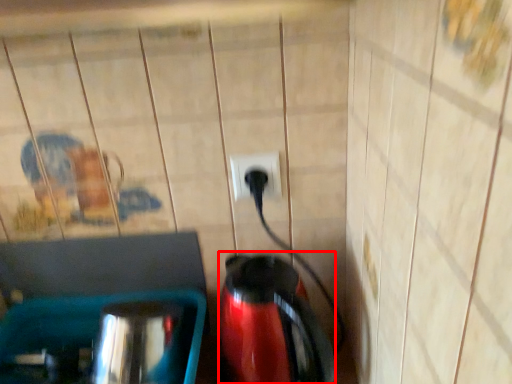
Question: From the image's perspective, what is the correct spatial positioning of coffeepot (annotated by the red box) in reference to power plugs and sockets?

Choices:
 (A) above
 (B) below

Answer: (B)